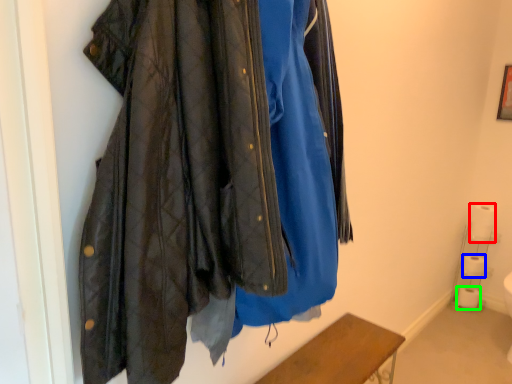
Question: Based on their relative distances, which object is farther from toilet paper (highlighted by a red box)? Choose from toilet paper (highlighted by a blue box) and toilet paper (highlighted by a green box).

Choices:
 (A) toilet paper
 (B) toilet paper

Answer: (B)